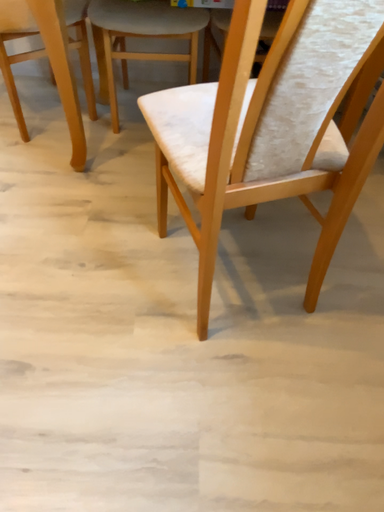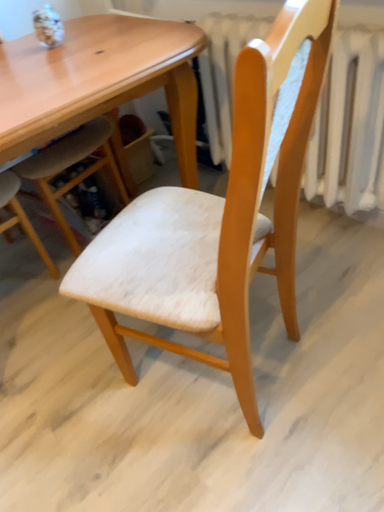
Question: How did the camera likely rotate when shooting the video?

Choices:
 (A) rotated downward
 (B) rotated upward

Answer: (B)